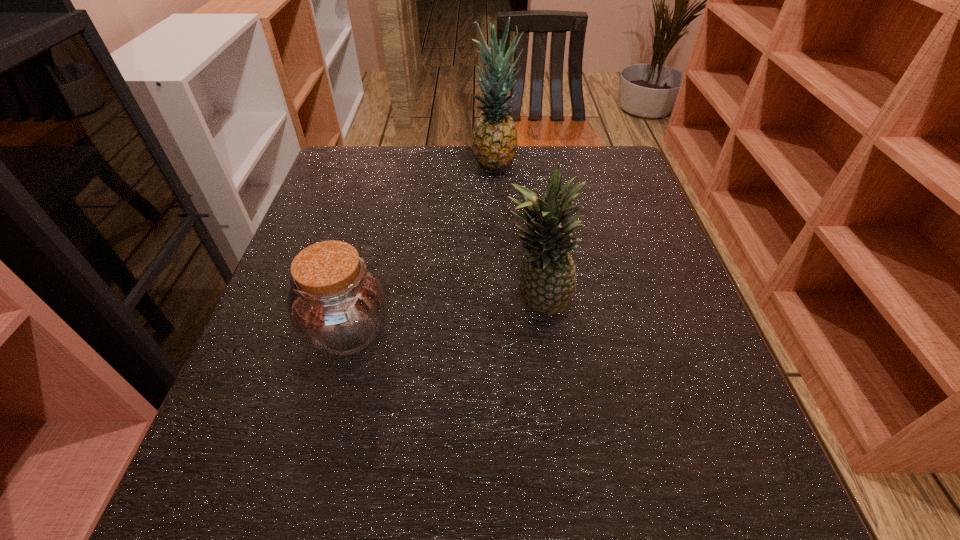
At what (x,y) coordinates should I click in order to perform the action: click on the farthest object. Please return your answer as a coordinate pair (x, y). The height and width of the screenshot is (540, 960). Looking at the image, I should click on (494, 138).

At what (x,y) coordinates should I click in order to perform the action: click on the tallest object. Please return your answer as a coordinate pair (x, y). The height and width of the screenshot is (540, 960). Looking at the image, I should click on (494, 138).

Find the location of a particular element. This screenshot has width=960, height=540. the shorter pineapple is located at coordinates (547, 283).

Image resolution: width=960 pixels, height=540 pixels. Find the location of `the nearer pineapple`. the nearer pineapple is located at coordinates (547, 283).

This screenshot has width=960, height=540. Identify the location of jar. pos(337,304).

Where is `the shortest object`? The image size is (960, 540). the shortest object is located at coordinates (337, 304).

Where is `blank space located on the front of the tallest object`? The image size is (960, 540). blank space located on the front of the tallest object is located at coordinates (498, 265).

Where is `vacant region located on the back of the shorter pineapple`? This screenshot has width=960, height=540. vacant region located on the back of the shorter pineapple is located at coordinates (532, 259).

Find the location of a particular element. Image resolution: width=960 pixels, height=540 pixels. free space located on the back of the jar is located at coordinates (384, 192).

Locate an element on the screen. The width and height of the screenshot is (960, 540). object at the far edge is located at coordinates (494, 138).